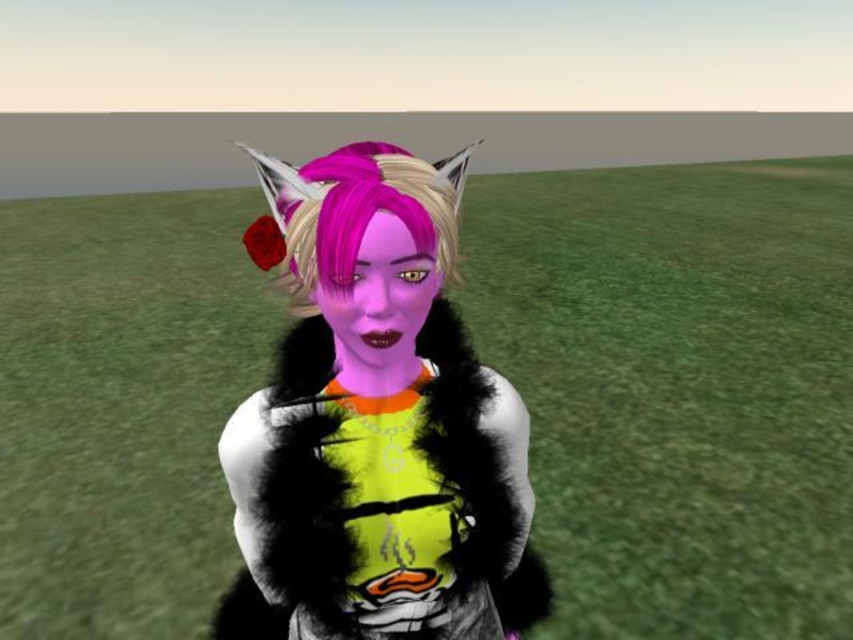
The character has a fuzzy fur vest at center and pink matte hair at center. From the viewer perspective, which object is closer to you?

The fuzzy fur vest at center is closer to the viewer because the pink matte hair at center is behind it.

You are a drone operator controlling a drone that is 12 inches in length. You need to fly your drone to the point marked at coordinates point (352, 154). Based on the scene description, will your drone be able to reach that point without any obstacles?

The distance between point (352, 154) and the viewer is 29.73 inches, which is greater than the drone length of 12 inches. Therefore, the drone can reach the point as there is enough space.